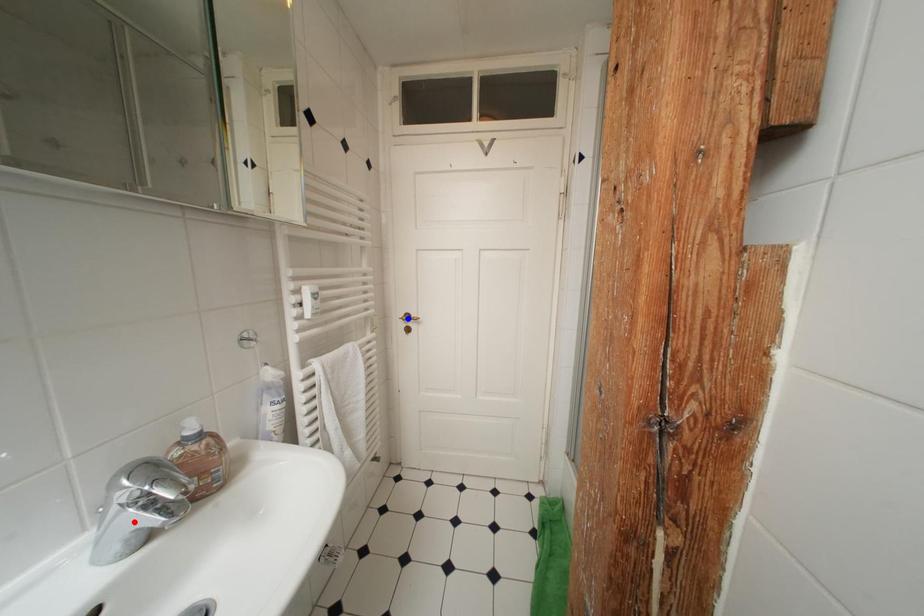
Question: In the image, two points are highlighted. Which point is nearer to the camera? Reply with the corresponding letter.

Choices:
 (A) blue point
 (B) red point

Answer: (B)